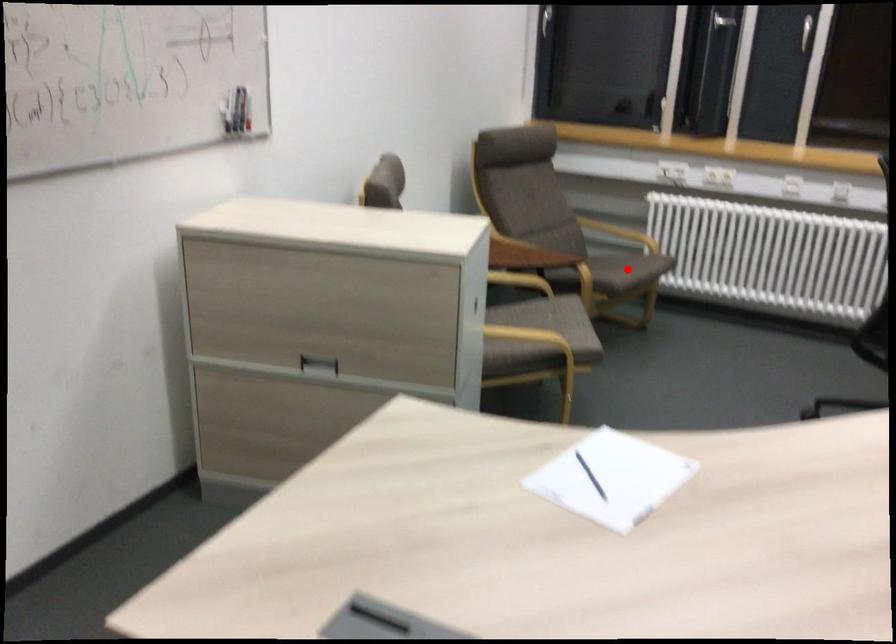
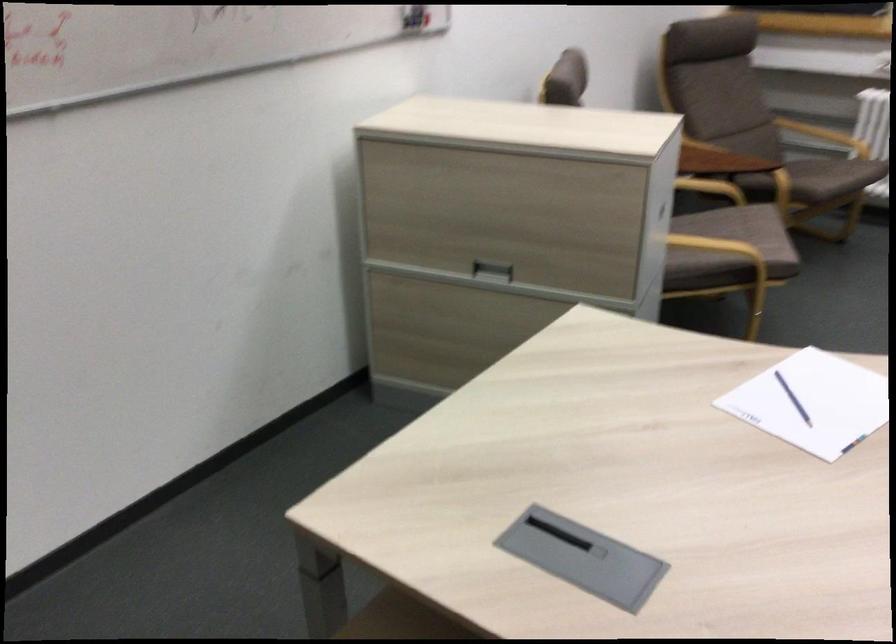
Question: I am providing you with two images of the same scene from different viewpoints. Image1 has a red point marked. In image2, the corresponding 3D location appears at what relative position? Reply with the corresponding letter.

Choices:
 (A) Closer
 (B) Farther

Answer: (A)